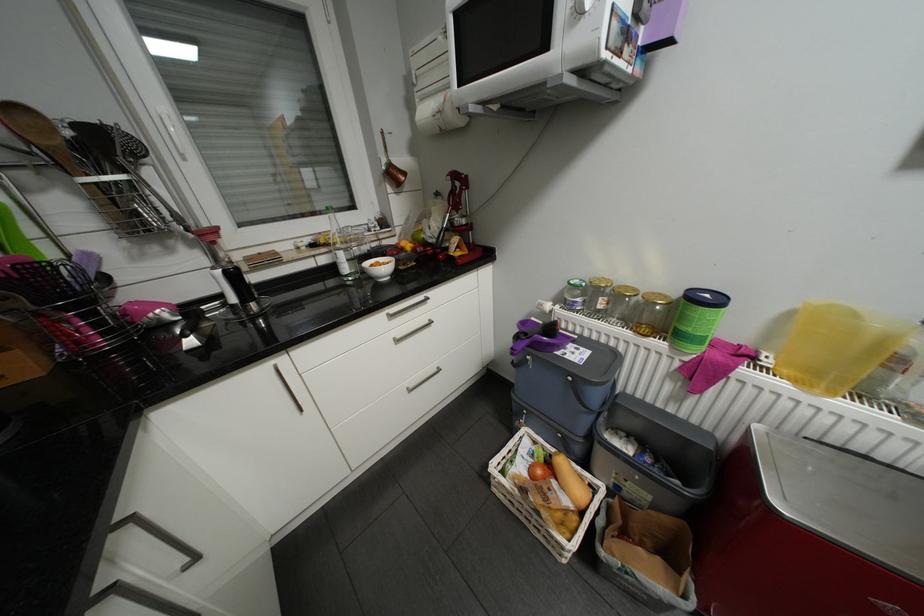
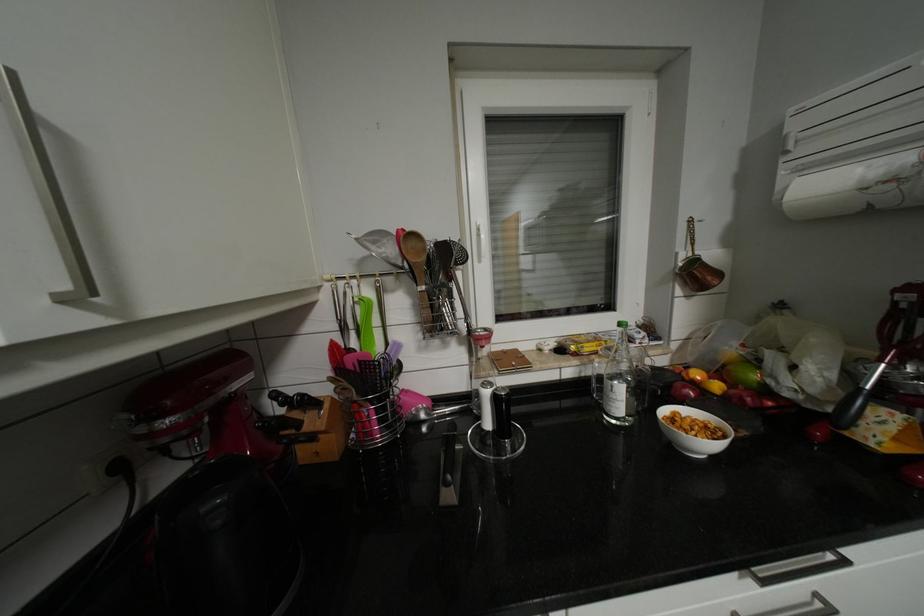
The point at (x=417, y=245) is marked in the first image. Where is the corresponding point in the second image?

(724, 386)